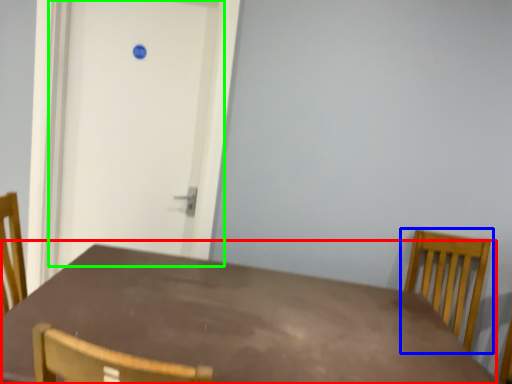
Question: Which object is positioned closest to table (highlighted by a red box)? Select from chair (highlighted by a blue box) and door (highlighted by a green box).

Choices:
 (A) chair
 (B) door

Answer: (B)